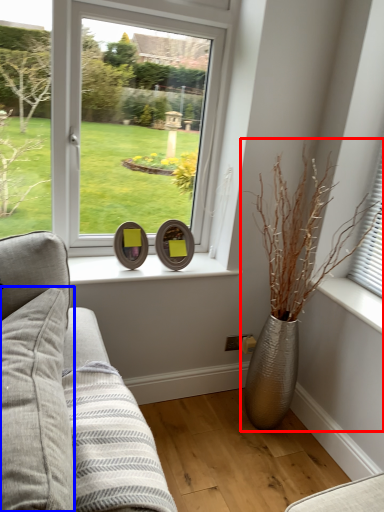
Question: Which of the following is the farthest to the observer, houseplant (highlighted by a red box) or pillow (highlighted by a blue box)?

Choices:
 (A) houseplant
 (B) pillow

Answer: (A)